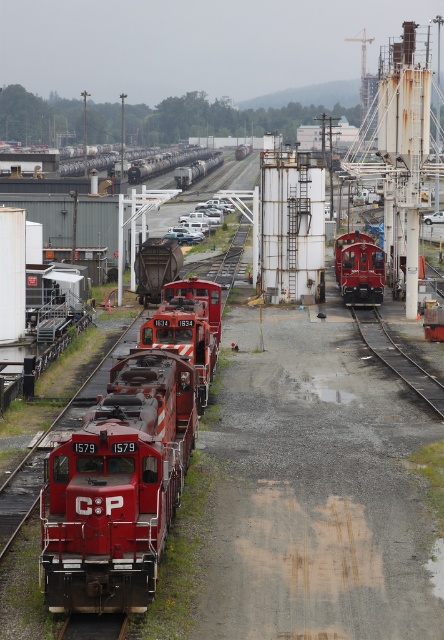
You are a railway engineer assessing the space between two parallel tracks in the yard. You need to determine if a new railcar, which is 1.2 meters wide, can fit between the matte red train at center and the shiny red train at center. Based on the scene, can the railcar pass through this space?

The matte red train at center is larger in size than the shiny red train at center. However, the exact distance between them isn not provided. Without knowing the space between the two trains, it is impossible to determine if the railcar can pass through.